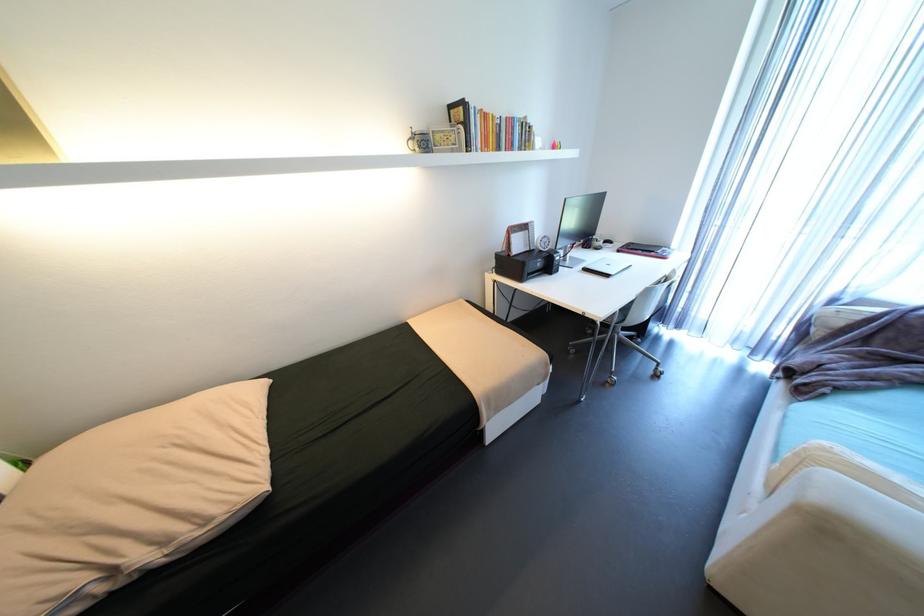
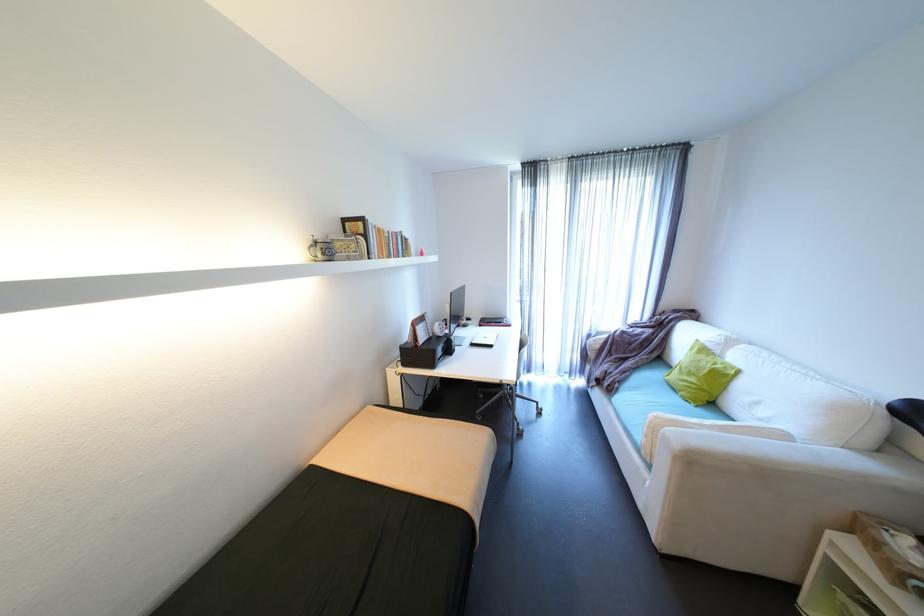
Locate, in the second image, the point that corresponds to (521,232) in the first image.

(426, 323)